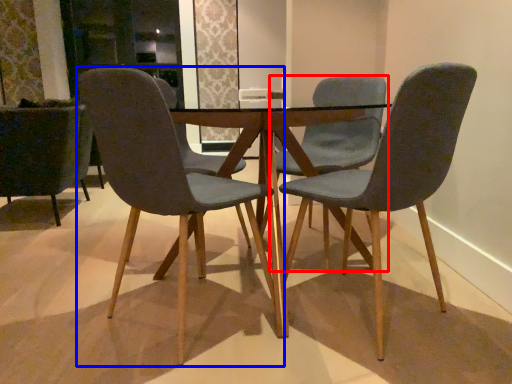
Question: Among these objects, which one is farthest to the camera, chair (highlighted by a red box) or chair (highlighted by a blue box)?

Choices:
 (A) chair
 (B) chair

Answer: (A)